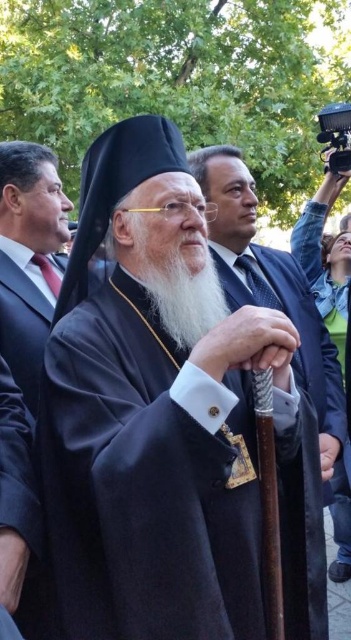
Question: Is black velvet robe at center below matte black robe at center?

Choices:
 (A) no
 (B) yes

Answer: (B)

Question: Considering the real-world distances, which object is closest to the black velvet robe at center?

Choices:
 (A) matte black robe at center
 (B) matte black suit at left
 (C) white matte beard at center
 (D) blue denim jacket at upper right

Answer: (C)

Question: Which point is farther to the camera?

Choices:
 (A) black velvet robe at center
 (B) white matte beard at center
 (C) matte black robe at center
 (D) matte black suit at left

Answer: (C)

Question: Does matte black robe at center appear over white matte beard at center?

Choices:
 (A) yes
 (B) no

Answer: (B)

Question: Is black velvet robe at center in front of matte black robe at center?

Choices:
 (A) yes
 (B) no

Answer: (A)

Question: Among these points, which one is farthest from the camera?

Choices:
 (A) (155, 531)
 (B) (55, 160)

Answer: (B)